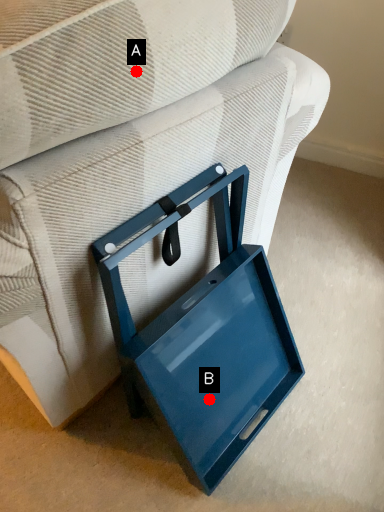
Question: Two points are circled on the image, labeled by A and B beside each circle. Which point is farther from the camera taking this photo?

Choices:
 (A) A is further
 (B) B is further

Answer: (B)